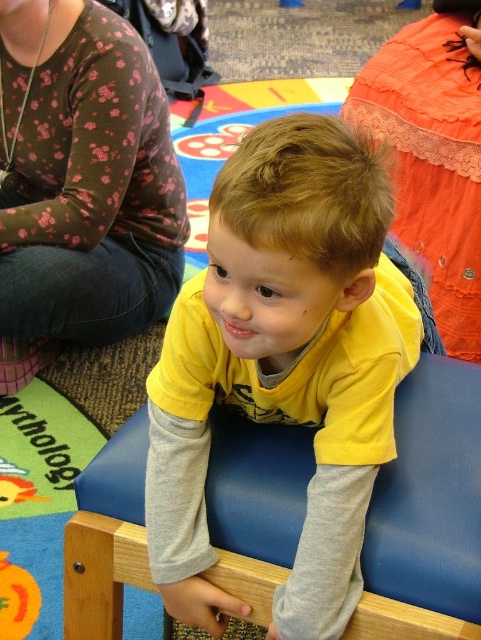
Question: Is floral print sweater at upper left thinner than wooden chair at center?

Choices:
 (A) no
 (B) yes

Answer: (B)

Question: Among these points, which one is farthest from the camera?

Choices:
 (A) (352, 428)
 (B) (469, 372)

Answer: (B)

Question: Observing the image, what is the correct spatial positioning of floral print sweater at upper left in reference to orange lace dress at upper right?

Choices:
 (A) below
 (B) above

Answer: (A)

Question: Can you confirm if yellow matte shirt at center is bigger than orange lace dress at upper right?

Choices:
 (A) yes
 (B) no

Answer: (B)

Question: Which object appears closest to the camera in this image?

Choices:
 (A) yellow matte shirt at center
 (B) wooden chair at center

Answer: (A)

Question: Estimate the real-world distances between objects in this image. Which object is closer to the orange lace dress at upper right?

Choices:
 (A) wooden chair at center
 (B) floral print sweater at upper left
 (C) yellow matte shirt at center

Answer: (B)